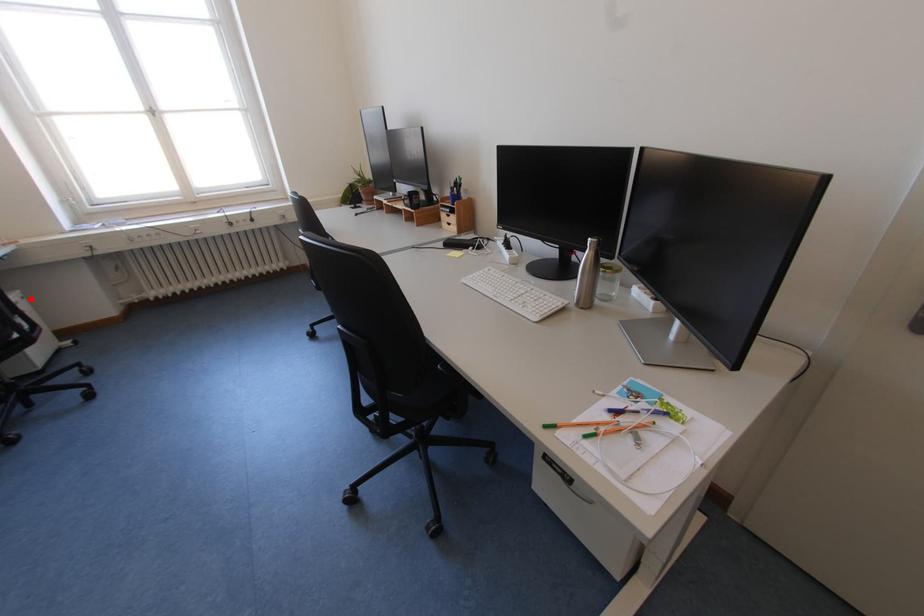
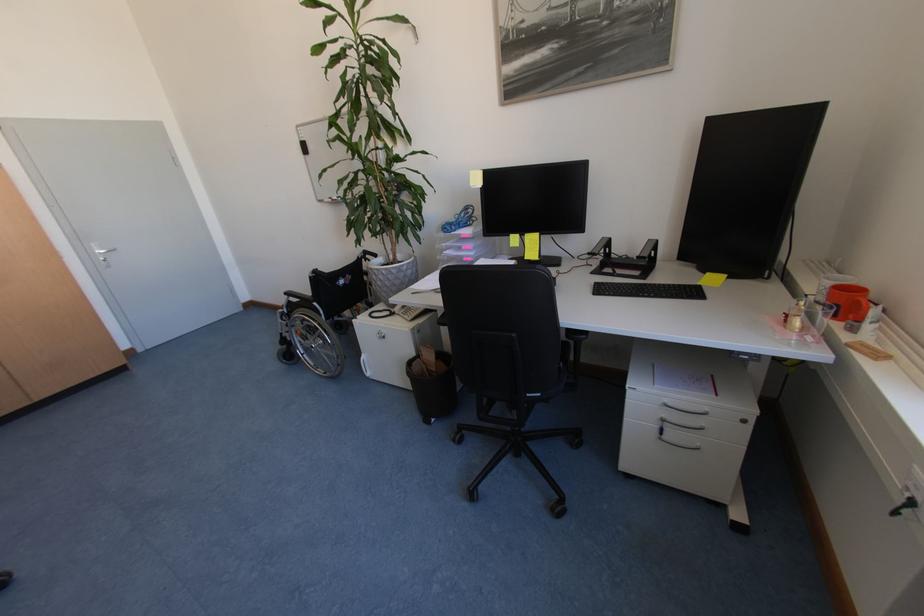
In the second image, find the point that corresponds to the highlighted location in the first image.

(751, 422)